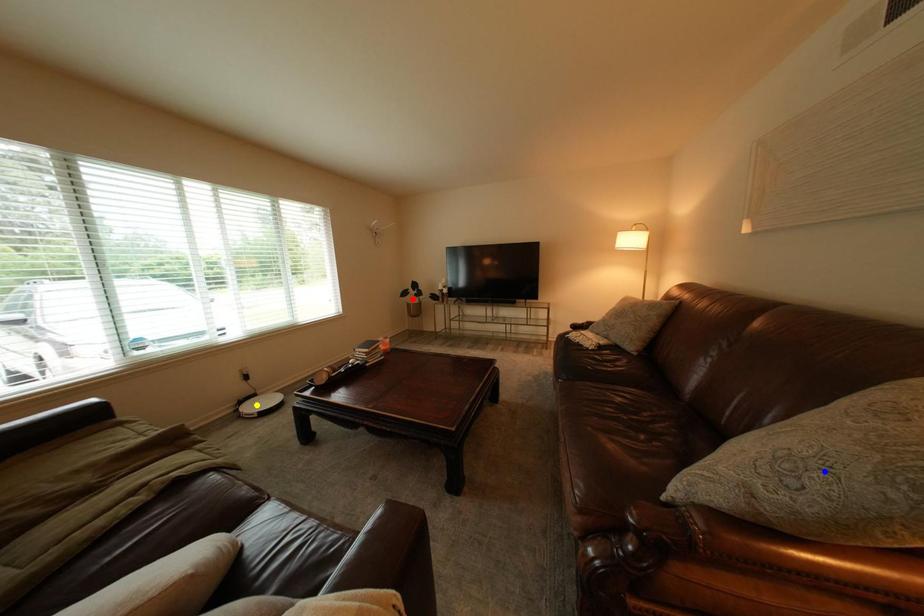
Order these from farthest to nearest:
yellow point | red point | blue point

red point < yellow point < blue point